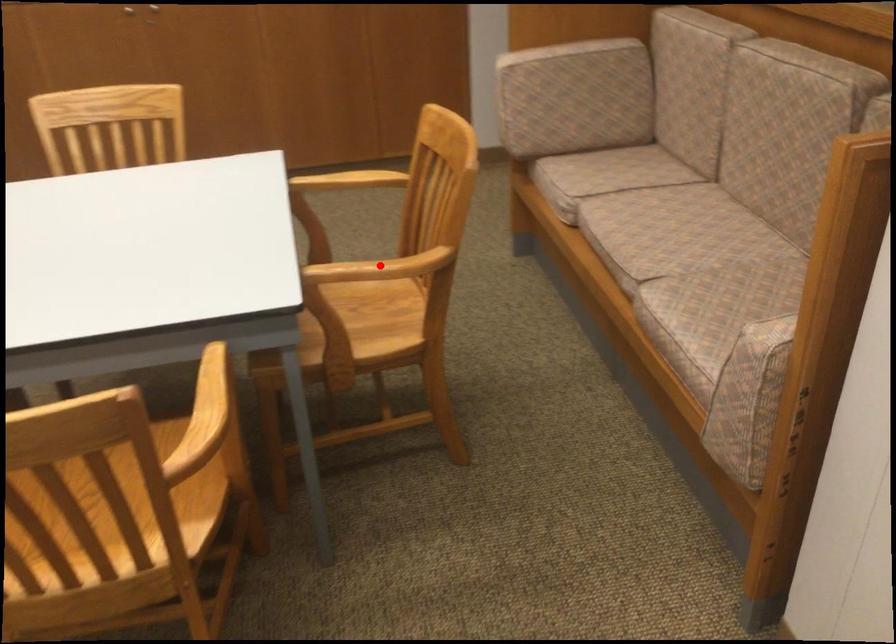
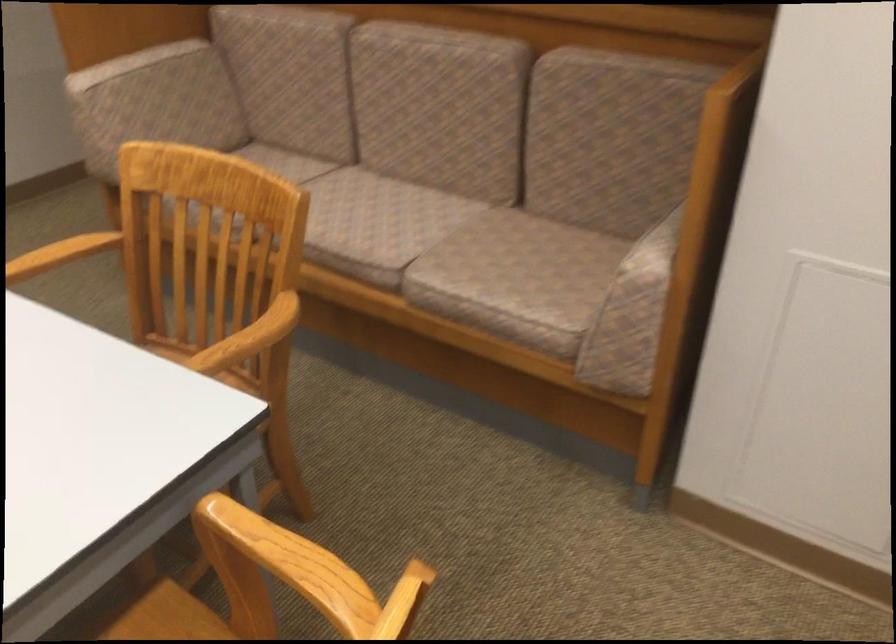
The point at the highlighted location is marked in the first image. Where is the corresponding point in the second image?

(248, 339)